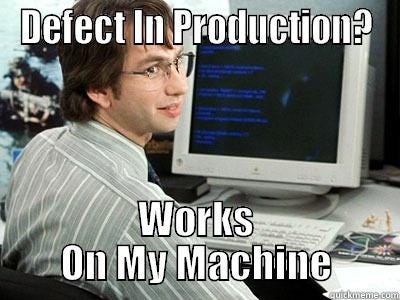
The height and width of the screenshot is (300, 400). I want to click on mouse pad, so click(x=366, y=259).